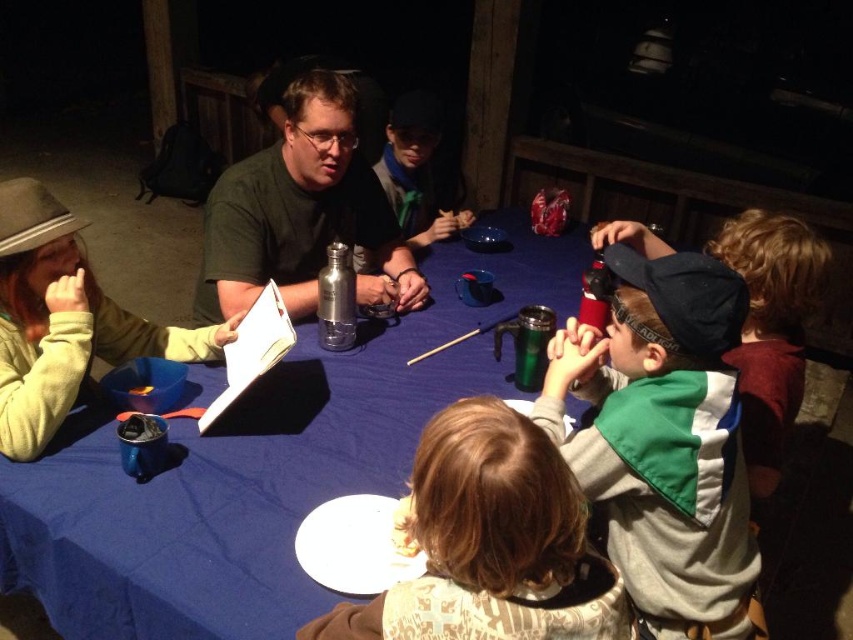
Can you confirm if green matte shirt at center is wider than white paper plate at lower center?

Indeed, green matte shirt at center has a greater width compared to white paper plate at lower center.

Between green matte shirt at center and white paper plate at lower center, which one is positioned lower?

white paper plate at lower center is below.

I want to click on green matte shirt at center, so click(x=302, y=212).

Is green fleece jacket at center positioned behind green scarf at center?

That is False.

Does green fleece jacket at center have a greater width compared to green scarf at center?

Incorrect, green fleece jacket at center's width does not surpass green scarf at center's.

Does point (639, 532) come in front of point (392, 164)?

Yes, point (639, 532) is closer to viewer.

You are a GUI agent. You are given a task and a screenshot of the screen. Output one action in this format:
    pyautogui.click(x=<x>, y=<y>)
    Task: Click on the green fleece jacket at center
    
    Given the screenshot: What is the action you would take?
    pyautogui.click(x=668, y=442)

Who is shorter, blue fabric table at center or light brown hair at center?

With less height is light brown hair at center.

Does blue fabric table at center come behind light brown hair at center?

Yes.

Between point (474, 365) and point (502, 529), which one is positioned in front?

Point (502, 529) is in front.

In order to click on blue fabric table at center in this screenshot , I will do `click(258, 468)`.